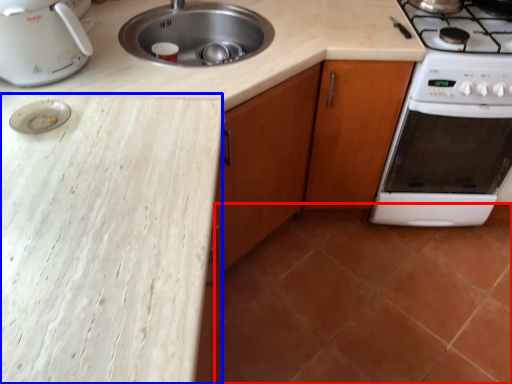
Question: Which of the following is the farthest to the observer, tile (highlighted by a red box) or counter top (highlighted by a blue box)?

Choices:
 (A) tile
 (B) counter top

Answer: (A)